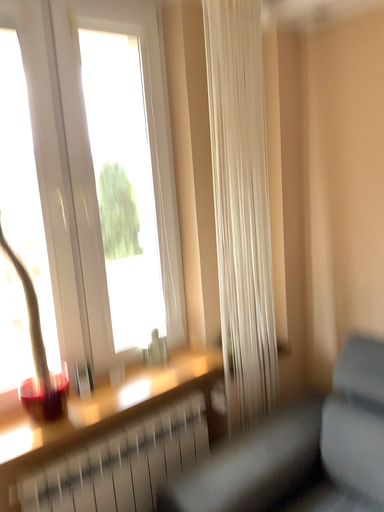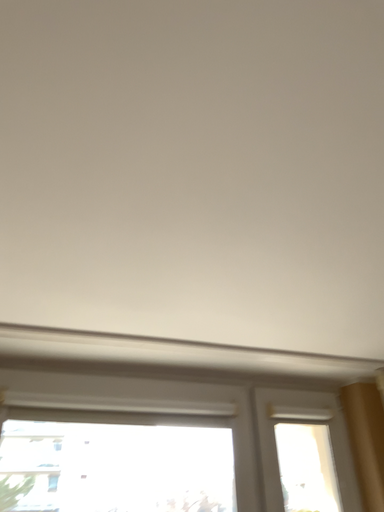
Question: Which way did the camera rotate in the video?

Choices:
 (A) rotated downward
 (B) rotated upward

Answer: (B)